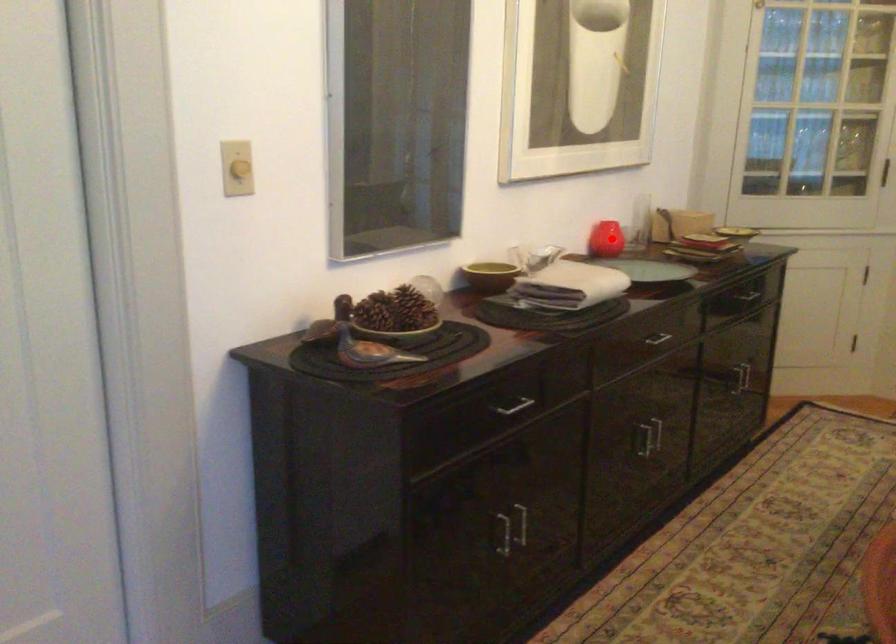
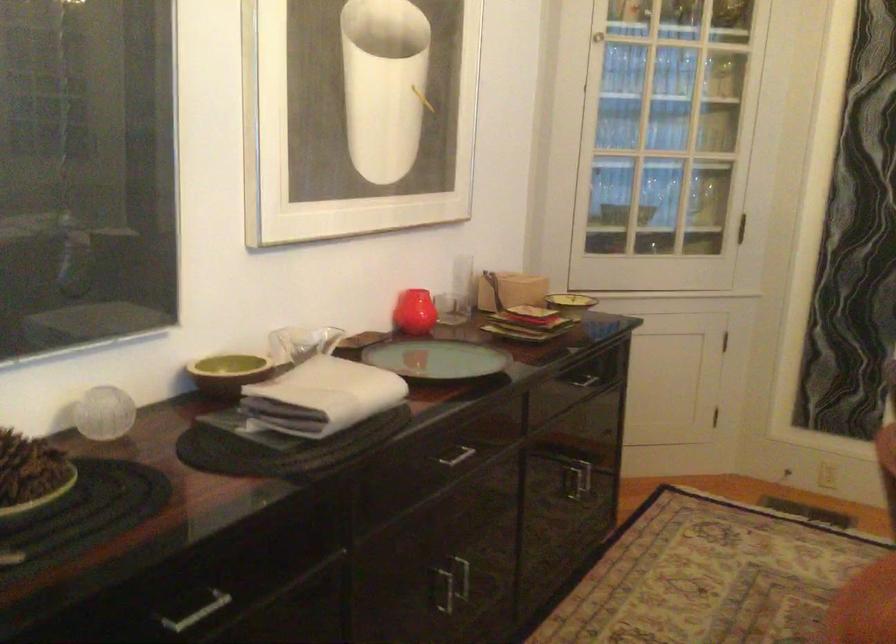
The point at the highlighted location is marked in the first image. Where is the corresponding point in the second image?

(414, 312)